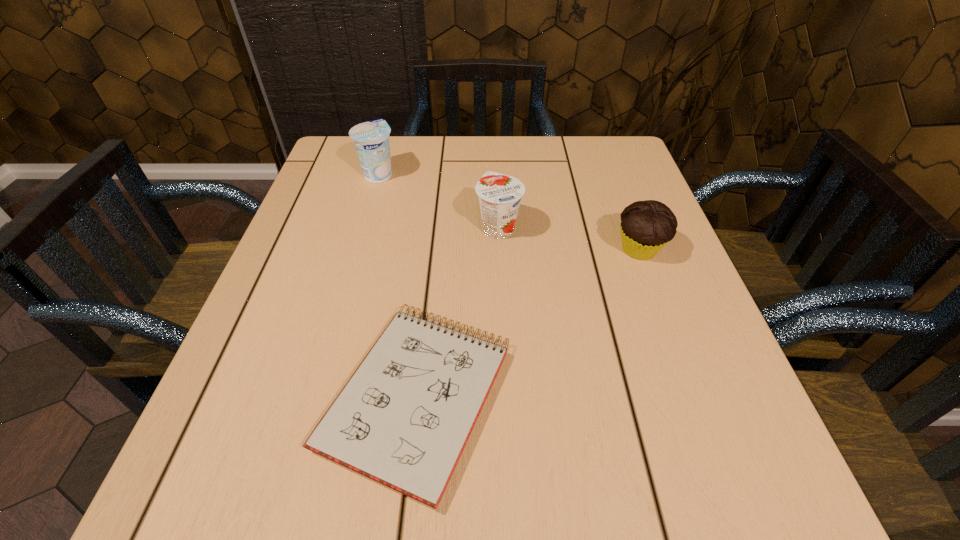
The height and width of the screenshot is (540, 960). What are the coordinates of `object located at the far edge` in the screenshot? It's located at (371, 139).

Where is `object present at the near edge`? The height and width of the screenshot is (540, 960). object present at the near edge is located at coordinates (403, 419).

Where is `yogurt located in the left edge section of the desktop`? The width and height of the screenshot is (960, 540). yogurt located in the left edge section of the desktop is located at coordinates (371, 139).

Where is `notepad present at the left edge`? notepad present at the left edge is located at coordinates (403, 419).

Locate an element on the screen. The image size is (960, 540). object at the right edge is located at coordinates (646, 226).

Locate an element on the screen. The image size is (960, 540). object positioned at the far left corner is located at coordinates (371, 139).

Locate an element on the screen. object located in the near left corner section of the desktop is located at coordinates (403, 419).

The height and width of the screenshot is (540, 960). In the image, there is a desktop. Identify the location of free space at the far edge. (512, 168).

Locate an element on the screen. This screenshot has height=540, width=960. free space at the left edge is located at coordinates 364,230.

Locate an element on the screen. This screenshot has width=960, height=540. vacant area at the right edge is located at coordinates (670, 307).